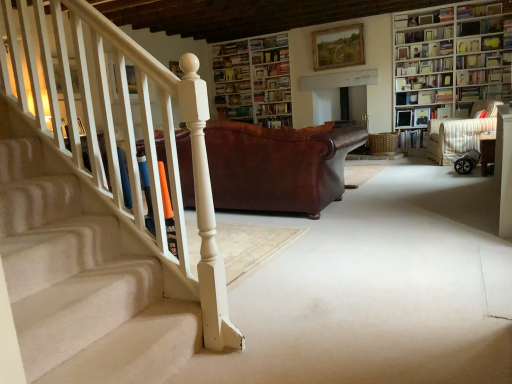
Question: Is hardcover book at upper right, acting as the 9th book starting from the bottom, at the left side of white wooden bookcase at upper center, which appears as the 2th bookcase when viewed from the right?

Choices:
 (A) no
 (B) yes

Answer: (A)

Question: From the image's perspective, is hardcover book at upper right, placed as the third book when sorted from top to bottom, on top of white wooden bookcase at upper center, which ranks as the 2th bookcase in front-to-back order?

Choices:
 (A) no
 (B) yes

Answer: (B)

Question: Does hardcover book at upper right, placed as the third book when sorted from top to bottom, come behind white wooden bookcase at upper center, arranged as the first bookcase when viewed from the left?

Choices:
 (A) yes
 (B) no

Answer: (B)

Question: Can you confirm if hardcover book at upper right, acting as the 9th book starting from the bottom, is taller than white wooden bookcase at upper center, which ranks as the 2th bookcase in front-to-back order?

Choices:
 (A) no
 (B) yes

Answer: (A)

Question: Is hardcover book at upper right, placed as the third book when sorted from top to bottom, positioned with its back to white wooden bookcase at upper center, which is the 1th bookcase in back-to-front order?

Choices:
 (A) yes
 (B) no

Answer: (B)

Question: In terms of width, does wooden chair at right look wider or thinner when compared to hardcover book at upper right, acting as the 8th book starting from the bottom?

Choices:
 (A) wide
 (B) thin

Answer: (A)

Question: Is wooden chair at right situated inside hardcover book at upper right, acting as the 8th book starting from the bottom, or outside?

Choices:
 (A) inside
 (B) outside

Answer: (B)

Question: Considering the relative positions of wooden chair at right and hardcover book at upper right, acting as the 8th book starting from the bottom, in the image provided, is wooden chair at right to the left or to the right of hardcover book at upper right, acting as the 8th book starting from the bottom,?

Choices:
 (A) right
 (B) left

Answer: (A)

Question: Is wooden chair at right in front of or behind hardcover book at upper right, acting as the 8th book starting from the bottom, in the image?

Choices:
 (A) front
 (B) behind

Answer: (A)

Question: From the image's perspective, is hardcover book at center, marked as the 5th book in a bottom-to-top arrangement, located above or below hardcover book at upper right, acting as the eleventh book starting from the top?

Choices:
 (A) above
 (B) below

Answer: (A)

Question: Is hardcover book at center, marked as the seventh book in a top-to-bottom arrangement, spatially inside hardcover book at upper right, acting as the eleventh book starting from the top, or outside of it?

Choices:
 (A) outside
 (B) inside

Answer: (A)

Question: Is point (270, 102) closer or farther from the camera than point (410, 147)?

Choices:
 (A) closer
 (B) farther

Answer: (A)

Question: In terms of height, does hardcover book at center, marked as the 5th book in a bottom-to-top arrangement, look taller or shorter compared to hardcover book at upper right, acting as the eleventh book starting from the top?

Choices:
 (A) short
 (B) tall

Answer: (A)

Question: From a real-world perspective, is hardcover book at upper right, acting as the 8th book starting from the bottom, positioned above or below wooden bookcase at upper right, the 2th bookcase viewed from the left?

Choices:
 (A) above
 (B) below

Answer: (A)

Question: Considering the positions of hardcover book at upper right, acting as the 8th book starting from the bottom, and wooden bookcase at upper right, which is the 2th bookcase in back-to-front order, in the image, is hardcover book at upper right, acting as the 8th book starting from the bottom, bigger or smaller than wooden bookcase at upper right, which is the 2th bookcase in back-to-front order,?

Choices:
 (A) small
 (B) big

Answer: (A)